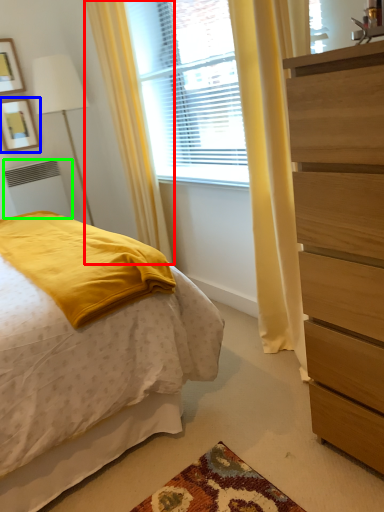
Question: Which object is the farthest from curtain (highlighted by a red box)? Choose among these: picture frame (highlighted by a blue box) or radiator (highlighted by a green box).

Choices:
 (A) picture frame
 (B) radiator

Answer: (A)